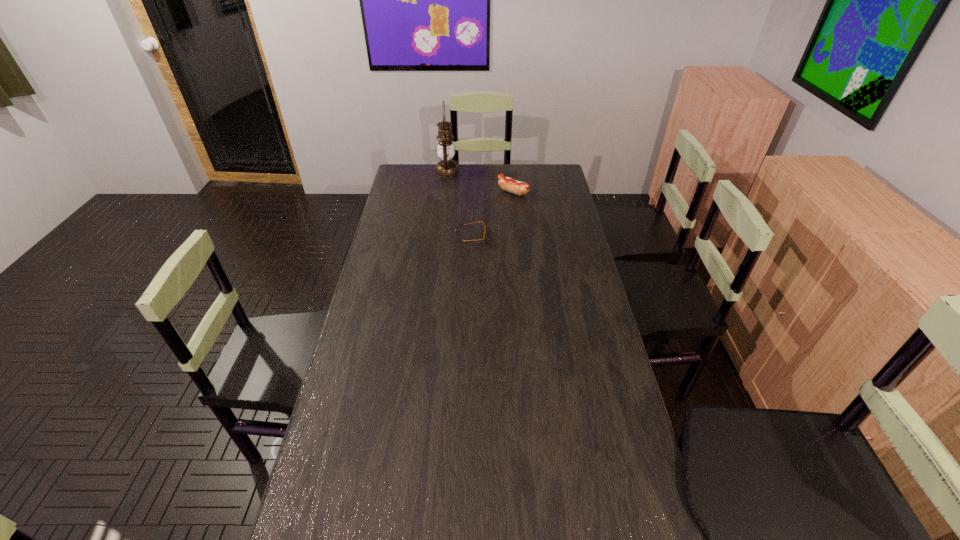
The image size is (960, 540). I want to click on the leftmost object, so click(x=446, y=167).

Identify the location of the farthest object. The width and height of the screenshot is (960, 540). click(x=446, y=167).

Locate an element on the screen. Image resolution: width=960 pixels, height=540 pixels. sausage is located at coordinates (507, 184).

Locate an element on the screen. the second nearest object is located at coordinates coord(507,184).

Where is `sunglasses`? The height and width of the screenshot is (540, 960). sunglasses is located at coordinates click(x=484, y=235).

At what (x,y) coordinates should I click in order to perform the action: click on the shortest object. Please return your answer as a coordinate pair (x, y). This screenshot has height=540, width=960. Looking at the image, I should click on (484, 235).

At what (x,y) coordinates should I click in order to perform the action: click on vacant space located 0.160m on the front of the leftmost object. Please return your answer as a coordinate pair (x, y). Looking at the image, I should click on (444, 197).

You are a GUI agent. You are given a task and a screenshot of the screen. Output one action in this format:
    pyautogui.click(x=<x>, y=<y>)
    Task: Click on the free space located on the left of the second farthest object
    
    Given the screenshot: What is the action you would take?
    pyautogui.click(x=468, y=193)

The height and width of the screenshot is (540, 960). In order to click on free space located on the front-facing side of the shortest object in this screenshot , I will do [522, 238].

Find the location of `oil lamp that is positioned at the far edge`. oil lamp that is positioned at the far edge is located at coordinates pos(446,167).